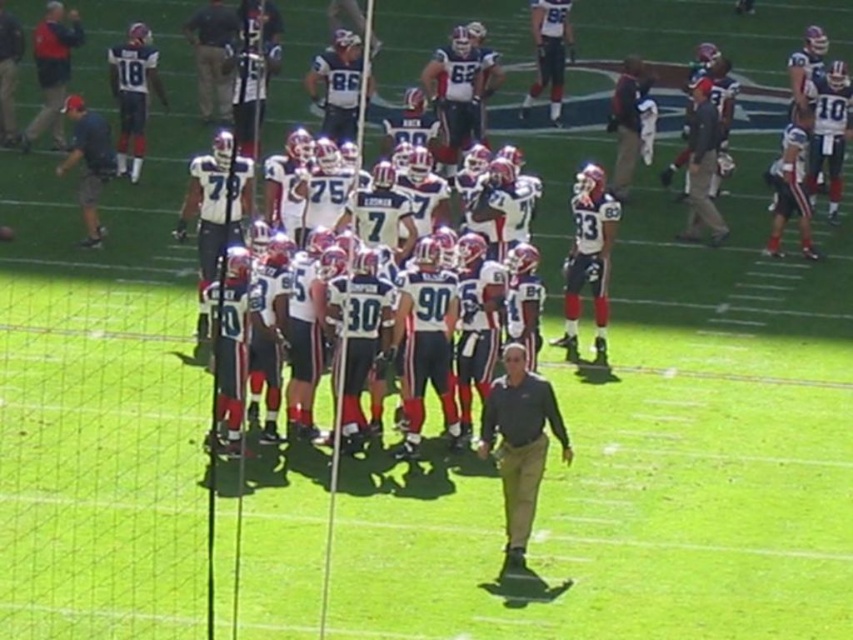
What do you see at coordinates (213, 58) in the screenshot? I see `dark blue uniform at center` at bounding box center [213, 58].

Does dark blue uniform at center appear on the right side of dark blue shirt at left?

Indeed, dark blue uniform at center is positioned on the right side of dark blue shirt at left.

Between point (206, 108) and point (97, 243), which one is positioned behind?

The point (206, 108) is behind.

You are a GUI agent. You are given a task and a screenshot of the screen. Output one action in this format:
    pyautogui.click(x=<x>, y=<y>)
    Task: Click on the dark blue uniform at center
    
    Given the screenshot: What is the action you would take?
    pyautogui.click(x=213, y=58)

Can you confirm if dark blue jacket at upper left is smaller than dark blue uniform at center?

Incorrect, dark blue jacket at upper left is not smaller in size than dark blue uniform at center.

Can you confirm if dark blue jacket at upper left is positioned below dark blue uniform at center?

Indeed, dark blue jacket at upper left is positioned under dark blue uniform at center.

Image resolution: width=853 pixels, height=640 pixels. Describe the element at coordinates (51, 68) in the screenshot. I see `dark blue jacket at upper left` at that location.

You are a GUI agent. You are given a task and a screenshot of the screen. Output one action in this format:
    pyautogui.click(x=<x>, y=<y>)
    Task: Click on the dark blue jacket at upper left
    The width and height of the screenshot is (853, 640).
    Given the screenshot: What is the action you would take?
    pyautogui.click(x=51, y=68)

Between point (697, 157) and point (3, 61), which one is positioned in front?

Point (697, 157)

Which is below, dark gray jacket at center or matte black jacket at upper left?

Positioned lower is dark gray jacket at center.

Identify the location of dark gray jacket at center. The width and height of the screenshot is (853, 640). (701, 166).